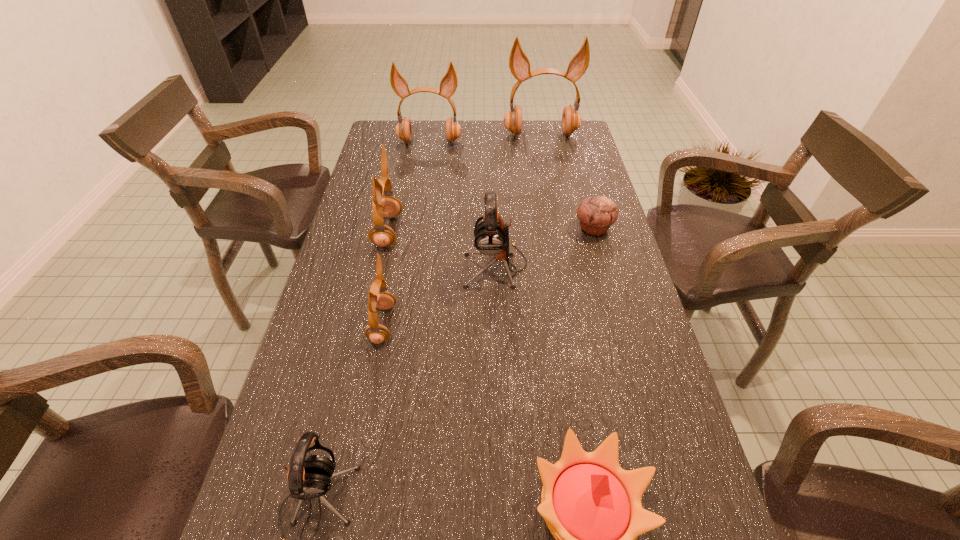
Image resolution: width=960 pixels, height=540 pixels. Identify the location of the rightmost brown earphone. (519, 64).

Locate an element on the screen. This screenshot has width=960, height=540. the biggest brown earphone is located at coordinates (519, 64).

You are a GUI agent. You are given a task and a screenshot of the screen. Output one action in this format:
    pyautogui.click(x=<x>, y=<y>)
    Task: Click on the seventh shortest object
    The width and height of the screenshot is (960, 540).
    Given the screenshot: What is the action you would take?
    pyautogui.click(x=448, y=84)

The image size is (960, 540). Find the location of `the third smallest brown earphone`. the third smallest brown earphone is located at coordinates (448, 84).

Where is `the bigger black earphone`? the bigger black earphone is located at coordinates (491, 235).

This screenshot has height=540, width=960. In order to click on the right black earphone in this screenshot , I will do `click(491, 235)`.

The width and height of the screenshot is (960, 540). Find the location of `the second smallest brown earphone`. the second smallest brown earphone is located at coordinates (387, 206).

Locate an element on the screen. This screenshot has width=960, height=540. the second nearest earphone is located at coordinates (377, 333).

Where is `the third nearest object`? The image size is (960, 540). the third nearest object is located at coordinates (377, 333).

Locate an element on the screen. This screenshot has height=540, width=960. the shortest object is located at coordinates (596, 214).